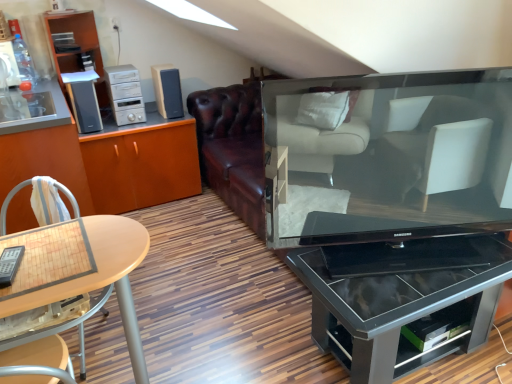
At what (x,y) coordinates should I click in order to perform the action: click on unoccupied region to the right of satin black speaker at upper left, arranged as the second appliance when viewed from the right. Please return your answer as a coordinate pair (x, y). Looking at the image, I should click on (114, 130).